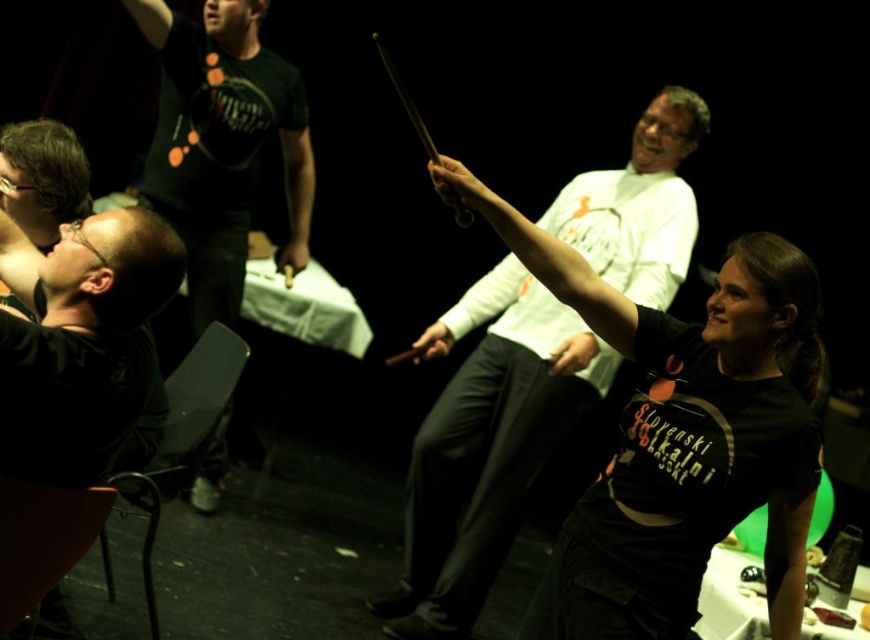
You are a photographer in the room and want to capture a photo where both the matte black shirt at center and the matte black shirt at upper left are clearly visible. Which shirt should you focus on first to ensure both are in frame?

The matte black shirt at center is taller than the matte black shirt at upper left, so focusing on the taller one first will help ensure both are visible in the frame.

Based on the photo, you are standing in the performance area and see two points marked in the scene. Which point is closer to you, point (519, 387) or point (25, 166)?

Point (519, 387) is further to the viewer than point (25, 166), so point (25, 166) is closer to you.